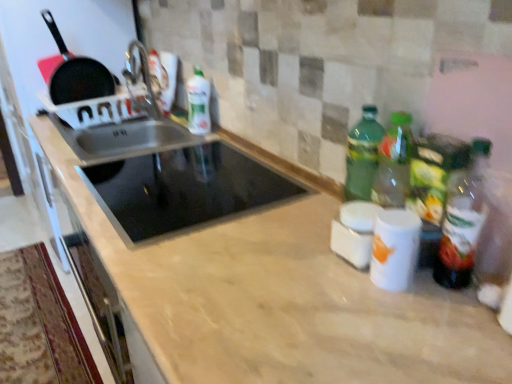
Question: From the image's perspective, is green glass bottle at right, the second bottle positioned from the left, above black matte frying pan at upper left?

Choices:
 (A) no
 (B) yes

Answer: (A)

Question: Is green glass bottle at right, acting as the 1th bottle starting from the right, shorter than black matte frying pan at upper left?

Choices:
 (A) yes
 (B) no

Answer: (A)

Question: Is green glass bottle at right, the second bottle in the top-to-bottom sequence, at the left side of black matte frying pan at upper left?

Choices:
 (A) no
 (B) yes

Answer: (A)

Question: From a real-world perspective, is green glass bottle at right, the second bottle in the top-to-bottom sequence, located beneath black matte frying pan at upper left?

Choices:
 (A) no
 (B) yes

Answer: (B)

Question: Can you confirm if green glass bottle at right, the second bottle positioned from the left, is bigger than black matte frying pan at upper left?

Choices:
 (A) yes
 (B) no

Answer: (B)

Question: From a real-world perspective, is green glass bottle at right, the 1th bottle in the front-to-back sequence, positioned over black matte frying pan at upper left based on gravity?

Choices:
 (A) yes
 (B) no

Answer: (B)

Question: From the image's perspective, would you say black matte frying pan at upper left is positioned over green glass bottle at right, the second bottle positioned from the left?

Choices:
 (A) no
 (B) yes

Answer: (B)

Question: Does black matte frying pan at upper left have a lesser width compared to green glass bottle at right, acting as the 1th bottle starting from the bottom?

Choices:
 (A) yes
 (B) no

Answer: (B)

Question: Would you say green glass bottle at right, the 1th bottle in the front-to-back sequence, is part of black matte frying pan at upper left's contents?

Choices:
 (A) no
 (B) yes

Answer: (A)

Question: Is black matte frying pan at upper left in front of green glass bottle at right, acting as the 1th bottle starting from the bottom?

Choices:
 (A) yes
 (B) no

Answer: (B)

Question: Considering the relative positions of black matte frying pan at upper left and green glass bottle at right, the 1th bottle in the front-to-back sequence, in the image provided, is black matte frying pan at upper left to the right of green glass bottle at right, the 1th bottle in the front-to-back sequence, from the viewer's perspective?

Choices:
 (A) no
 (B) yes

Answer: (A)

Question: Does black matte frying pan at upper left have a greater height compared to green glass bottle at right, acting as the 1th bottle starting from the bottom?

Choices:
 (A) no
 (B) yes

Answer: (B)

Question: Is black matte frying pan at upper left placed right next to green matte bottle at upper center, positioned as the first bottle in left-to-right order?

Choices:
 (A) no
 (B) yes

Answer: (A)